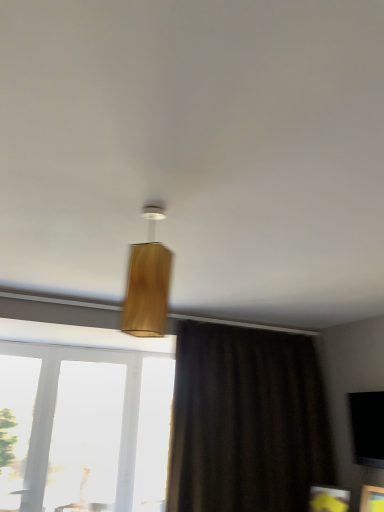
Question: Is transparent glass window at lower left, the second window positioned from the left, shorter than wooden lampshade at center?

Choices:
 (A) yes
 (B) no

Answer: (B)

Question: Is transparent glass window at lower left, which is the second window in right-to-left order, thinner than wooden lampshade at center?

Choices:
 (A) yes
 (B) no

Answer: (A)

Question: From a real-world perspective, is transparent glass window at lower left, which is the second window in right-to-left order, on top of wooden lampshade at center?

Choices:
 (A) yes
 (B) no

Answer: (B)

Question: Is transparent glass window at lower left, the second window positioned from the left, bigger than wooden lampshade at center?

Choices:
 (A) yes
 (B) no

Answer: (A)

Question: Does transparent glass window at lower left, the second window positioned from the left, lie in front of wooden lampshade at center?

Choices:
 (A) yes
 (B) no

Answer: (B)

Question: Based on their sizes in the image, would you say wooden lampshade at center is bigger or smaller than transparent glass window at left, the third window positioned from the left?

Choices:
 (A) big
 (B) small

Answer: (B)

Question: Is point (132, 331) positioned closer to the camera than point (64, 364)?

Choices:
 (A) farther
 (B) closer

Answer: (B)

Question: Visually, is wooden lampshade at center positioned to the left or to the right of transparent glass window at left, the third window positioned from the left?

Choices:
 (A) right
 (B) left

Answer: (A)

Question: From the image's perspective, is wooden lampshade at center located above or below transparent glass window at left, the third window positioned from the left?

Choices:
 (A) above
 (B) below

Answer: (A)

Question: Looking at the image, does transparent glass window screen at lower right seem bigger or smaller compared to transparent glass window at lower left, marked as the third window in a right-to-left arrangement?

Choices:
 (A) big
 (B) small

Answer: (B)

Question: Is point (375, 408) closer or farther from the camera than point (13, 415)?

Choices:
 (A) farther
 (B) closer

Answer: (B)

Question: Considering the positions of transparent glass window screen at lower right and transparent glass window at lower left, marked as the third window in a right-to-left arrangement, in the image, is transparent glass window screen at lower right taller or shorter than transparent glass window at lower left, marked as the third window in a right-to-left arrangement,?

Choices:
 (A) short
 (B) tall

Answer: (A)

Question: From a real-world perspective, is transparent glass window screen at lower right above or below transparent glass window at lower left, the 1th window from the left?

Choices:
 (A) above
 (B) below

Answer: (A)

Question: Would you say transparent glass window screen at lower right is to the left or to the right of transparent glass window at lower left, which is the second window in right-to-left order, in the picture?

Choices:
 (A) left
 (B) right

Answer: (B)

Question: From a real-world perspective, relative to transparent glass window at lower left, the second window positioned from the left, is transparent glass window screen at lower right vertically above or below?

Choices:
 (A) below
 (B) above

Answer: (B)